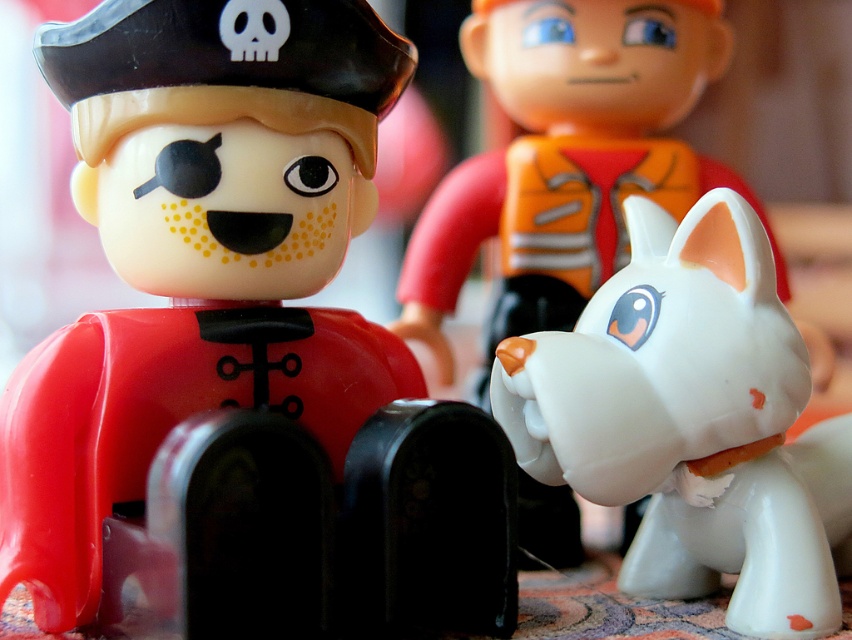
In the scene shown: You are a toy collector trying to place a new toy figure on the table. The existing figures are arranged such that the pirate has a matte black pirate hat at upper left. Where should you place your new toy so it doesn not block the view of the matte black pirate hat at upper left? Please provide coordinates in the format of point coordinates like point [240,349].

The matte black pirate hat at upper left is located at point [240,349]. To avoid blocking its view, place the new toy figure below or to the right of this coordinate, ensuring it does not overlap with or obscure the area around point [240,349].

You are a child playing with the toys and want to place the white matte dog at center on top of the matte black pirate hat at upper left. Is this possible based on their positions?

The matte black pirate hat at upper left is below the white matte dog at center, so placing the dog on top of the hat would require moving the dog downward to the hat.

You are a child trying to place a sticker on the toy scene. You want to put the sticker exactly between the matte black pirate hat at upper left and the white glossy dog at center. Which direction should you look to find the midpoint between them?

The matte black pirate hat at upper left is to the left of white glossy dog at center, so the midpoint between them would be to the right of the matte black pirate hat at upper left and to the left of the white glossy dog at center. Look between them for the midpoint.